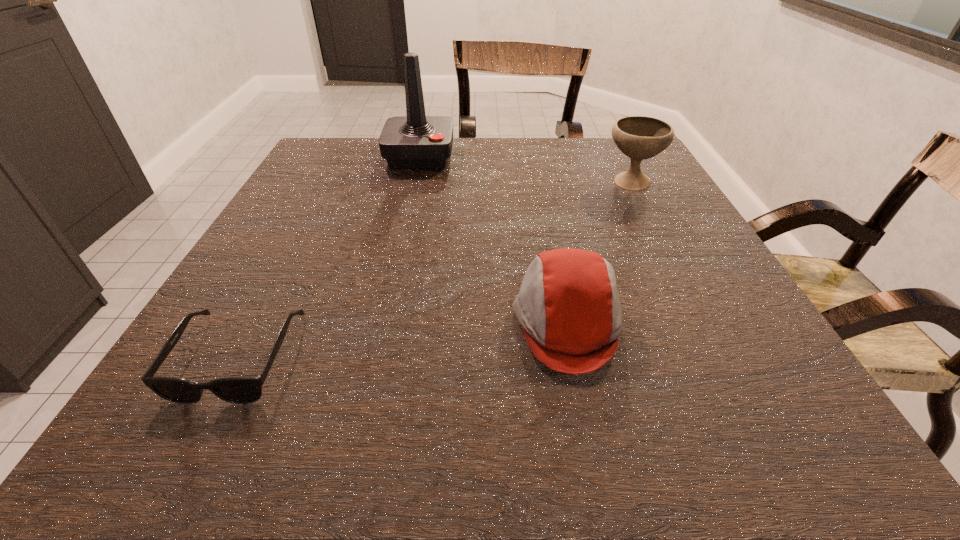
What are the coordinates of `object present at the far right corner` in the screenshot? It's located at (638, 137).

The image size is (960, 540). In the image, there is a desktop. Identify the location of free space at the far edge. (455, 139).

In order to click on free space at the near edge of the desktop in this screenshot , I will do `click(483, 394)`.

Where is `vacant area at the left edge of the desktop`? vacant area at the left edge of the desktop is located at coordinates (276, 292).

In the image, there is a desktop. Where is `blank space at the right edge`? blank space at the right edge is located at coordinates (640, 225).

Find the location of a particular element. Image resolution: width=960 pixels, height=540 pixels. vacant space at the far left corner of the desktop is located at coordinates (349, 170).

In the image, there is a desktop. Find the location of `free region at the near left corner`. free region at the near left corner is located at coordinates (213, 418).

Image resolution: width=960 pixels, height=540 pixels. I want to click on blank space at the near right corner, so click(x=713, y=429).

I want to click on unoccupied area between the third shortest object and the joystick, so click(x=525, y=170).

This screenshot has width=960, height=540. What are the coordinates of `unoccupied area between the third object from left to right and the chalice` in the screenshot? It's located at (599, 253).